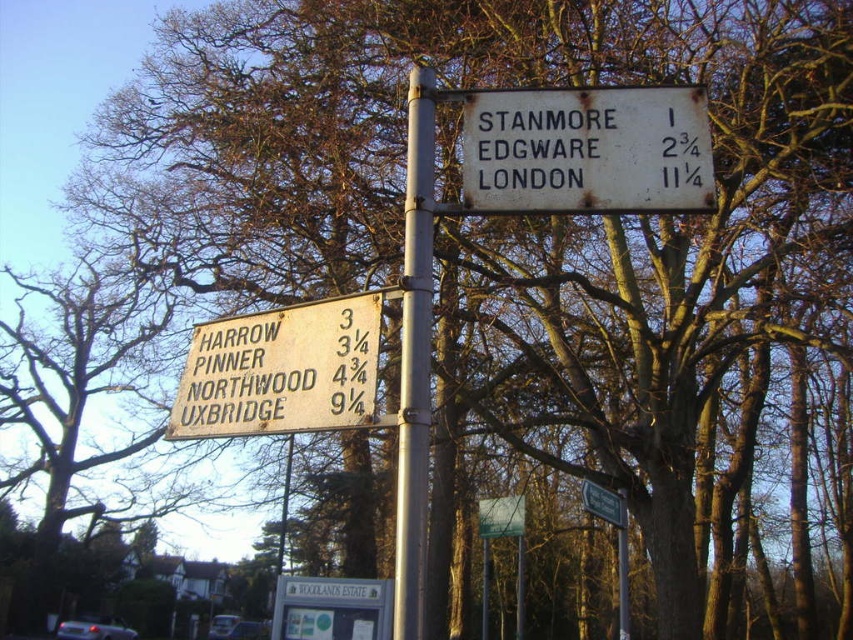
Is white wooden sign at lower left further to camera compared to green plastic street sign at center?

No, white wooden sign at lower left is in front of green plastic street sign at center.

Identify the location of white wooden sign at lower left. This screenshot has height=640, width=853. (282, 371).

Who is more forward, (688,122) or (316,330)?

Positioned in front is point (688,122).

Is rusty metal sign at upper center further to camera compared to brown wooden sign at lower left?

That is False.

Which is behind, point (706, 196) or point (299, 374)?

Positioned behind is point (299, 374).

Locate an element on the screen. rusty metal sign at upper center is located at coordinates (585, 150).

Who is positioned more to the left, white wooden sign at lower left or silver metallic pole at center?

white wooden sign at lower left

Is white wooden sign at lower left to the right of silver metallic pole at center from the viewer's perspective?

In fact, white wooden sign at lower left is to the left of silver metallic pole at center.

Who is more distant from viewer, (221,323) or (432,156)?

The point (221,323) is more distant.

Where is `white wooden sign at lower left`? The width and height of the screenshot is (853, 640). white wooden sign at lower left is located at coordinates (282, 371).